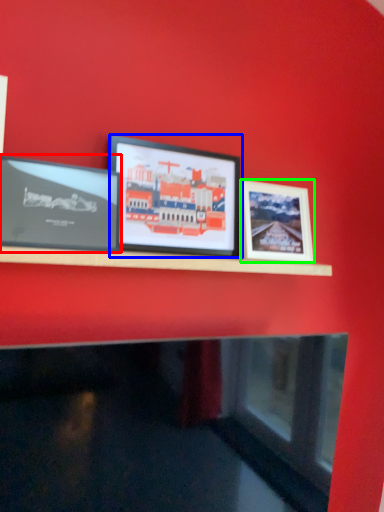
Question: Based on their relative distances, which object is nearer to picture frame (highlighted by a red box)? Choose from picture frame (highlighted by a blue box) and picture frame (highlighted by a green box).

Choices:
 (A) picture frame
 (B) picture frame

Answer: (A)